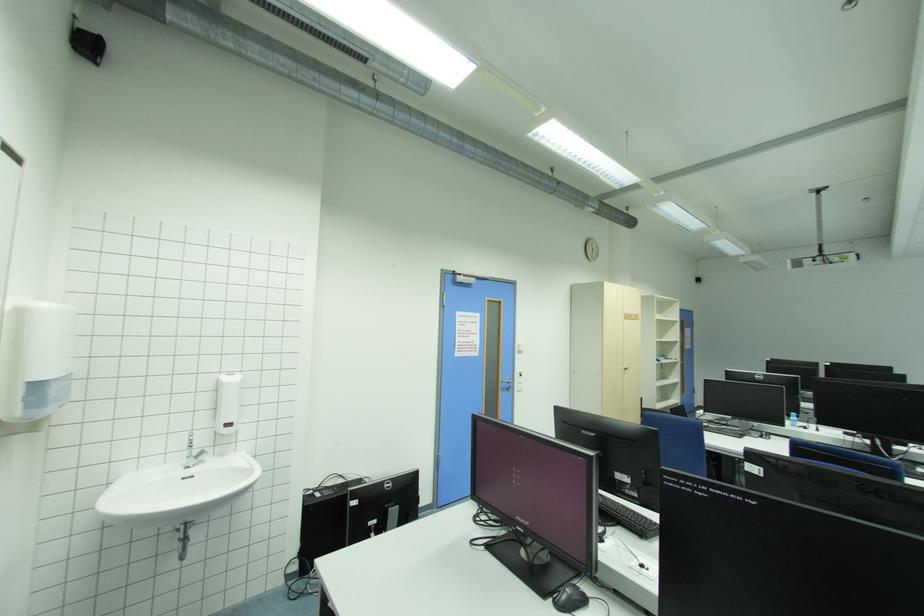
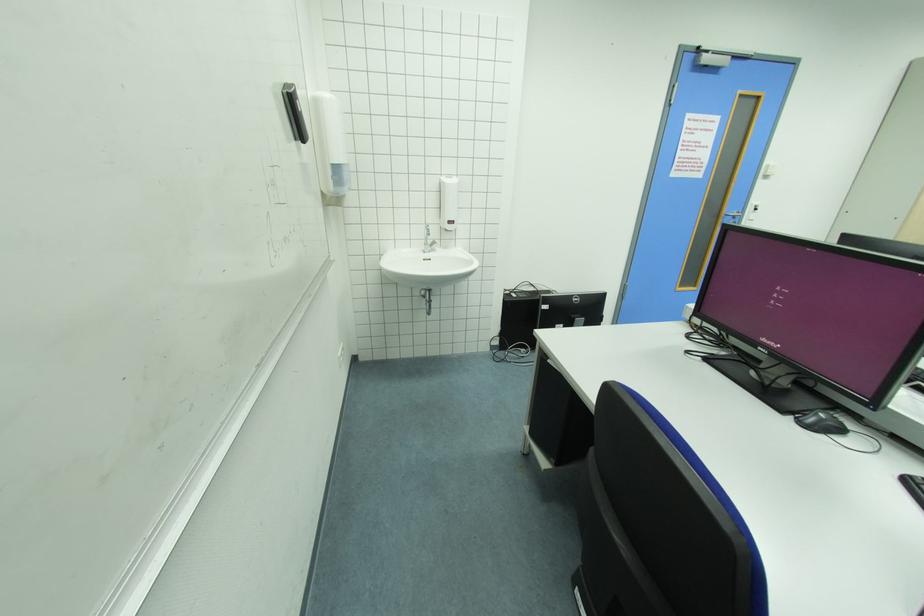
First-person continuous shooting, in which direction is the camera rotating?

The rotation direction of the camera is left-down.